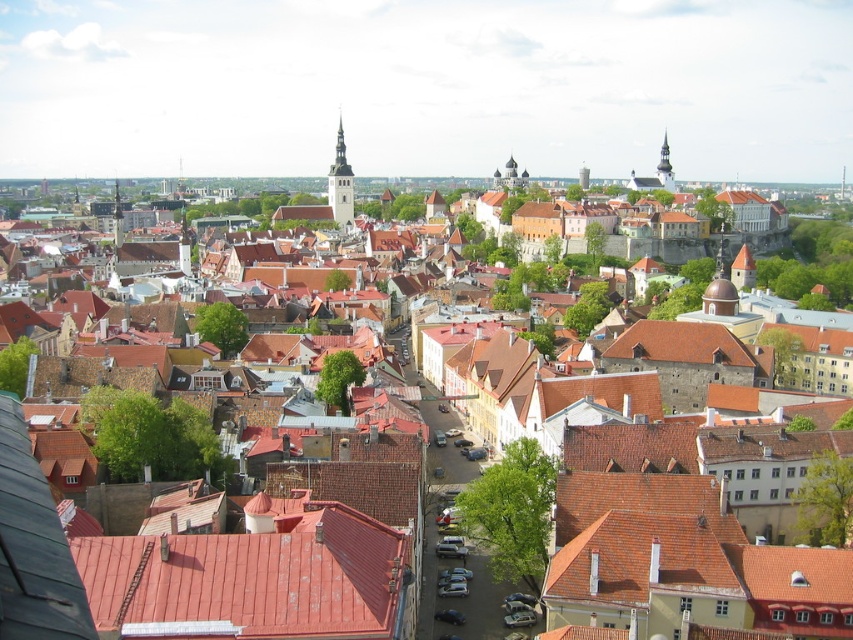
What do you see at coordinates (253, 580) in the screenshot? I see `red tile roof at center` at bounding box center [253, 580].

Does red tile roof at center have a lesser height compared to smooth stone tower at upper right?

Yes.

Locate an element on the screen. This screenshot has height=640, width=853. red tile roof at center is located at coordinates (253, 580).

Is smooth stone tower at center wider than smooth stone tower at upper right?

Yes.

How distant is smooth stone tower at center from smooth stone tower at upper right?

They are 131.13 meters apart.

The height and width of the screenshot is (640, 853). What do you see at coordinates (340, 184) in the screenshot?
I see `smooth stone tower at center` at bounding box center [340, 184].

Locate an element on the screen. The image size is (853, 640). smooth stone tower at center is located at coordinates (340, 184).

Looking at this image, is red tile roof at center wider than smooth stone tower at center?

Yes, red tile roof at center is wider than smooth stone tower at center.

Between red tile roof at center and smooth stone tower at center, which one has more height?

Standing taller between the two is smooth stone tower at center.

At what (x,y) coordinates should I click in order to perform the action: click on red tile roof at center. Please return your answer as a coordinate pair (x, y). This screenshot has width=853, height=640. Looking at the image, I should click on (253, 580).